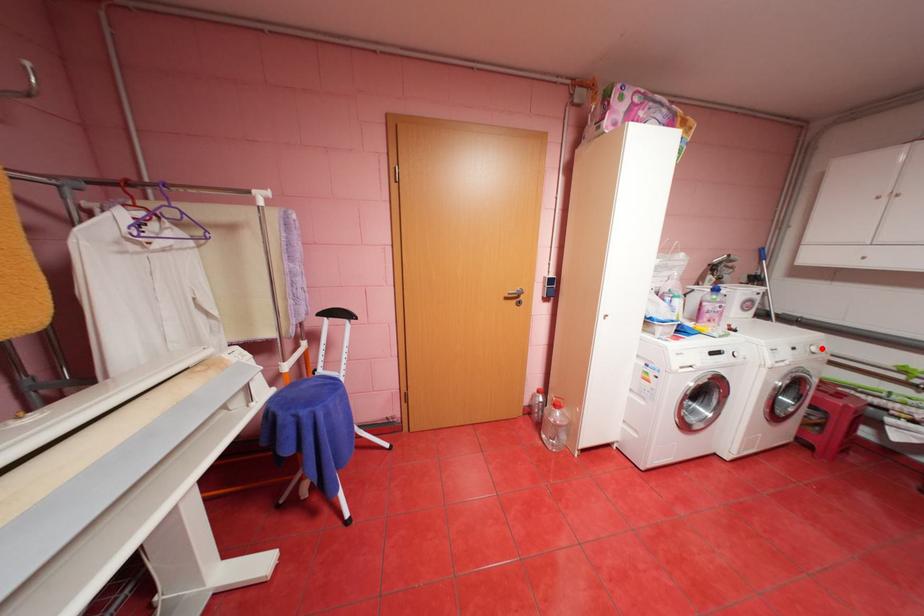
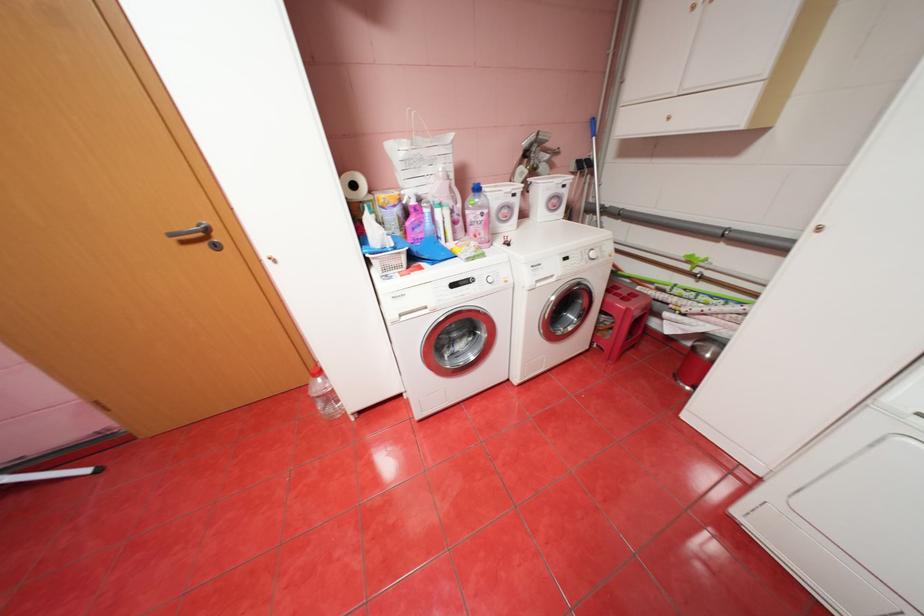
Question: I am providing you with two images of the same scene from different viewpoints. In image1, a red point is highlighted. Considering the same 3D point in image2, which of the following is correct?

Choices:
 (A) It is closer
 (B) It is farther

Answer: (B)